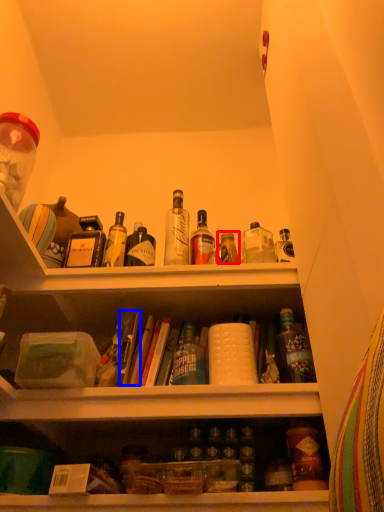
Question: Which object is closer to the camera taking this photo, bottle (highlighted by a red box) or book (highlighted by a blue box)?

Choices:
 (A) bottle
 (B) book

Answer: (B)